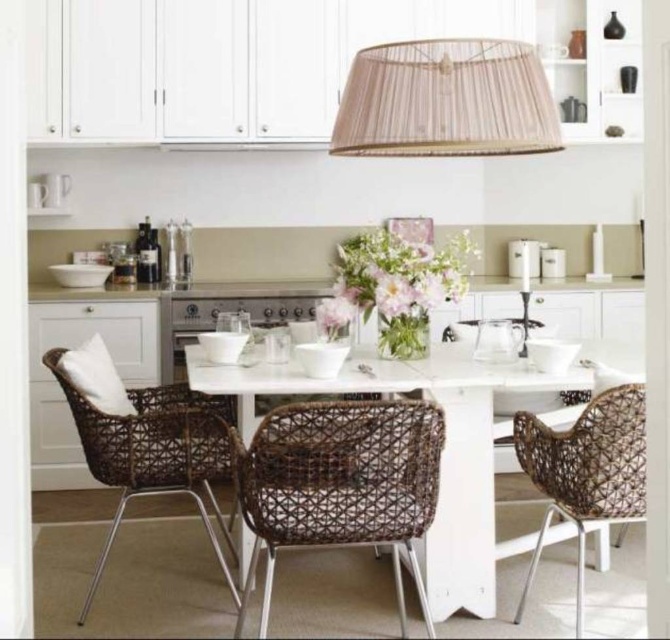
From the picture: You are standing in the modern kitchen and want to place a new decorative item exactly at the point marked as point (340, 483). What object is currently occupying that location?

The rattan chair at center is located at point (340, 483), so that location is currently occupied by the rattan chair at center.

You are hosting a dinner party and want to seat guests comfortably. Given the space available, which chair between the rattan chair at center and the brown woven chair at right would allow for more legroom?

The rattan chair at center is bigger than the brown woven chair at right, so it would provide more legroom for guests.

You are sitting at the white rectangular table in the dining area. You notice two chairs nearby. Which chair is closer to the left side of the table, the brown wicker chair at left or the brown woven chair at right?

The brown wicker chair at left is closer to the left side of the table because it is positioned to the left of the brown woven chair at right.